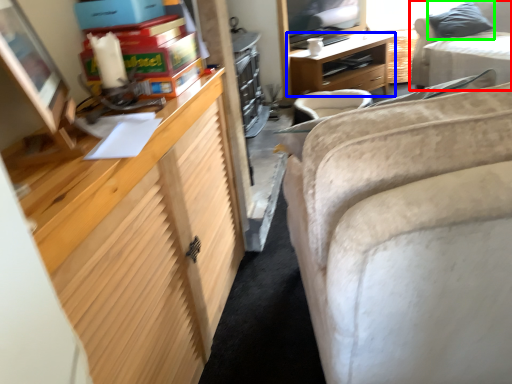
Question: Considering the real-world distances, which object is closest to studio couch (highlighted by a red box)? desk (highlighted by a blue box) or pillow (highlighted by a green box).

Choices:
 (A) desk
 (B) pillow

Answer: (B)